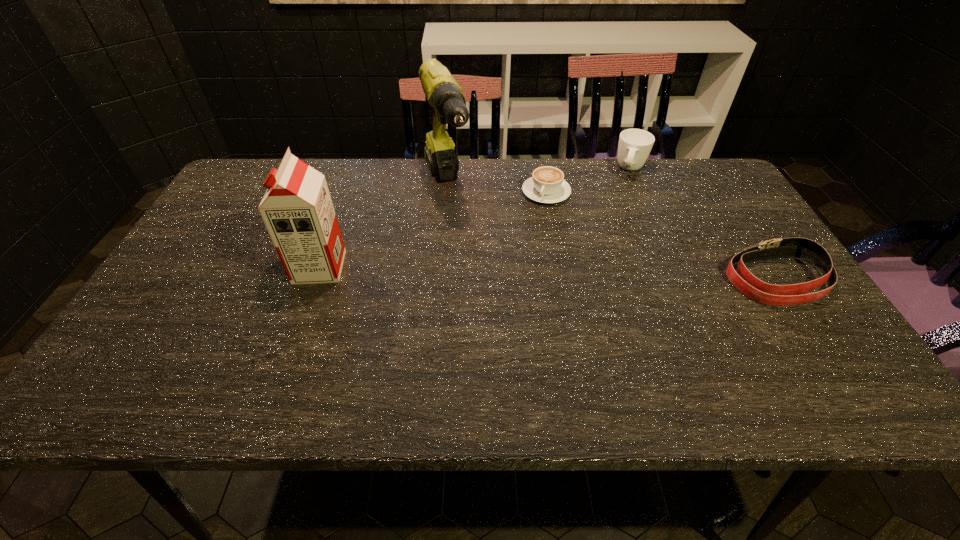
Find the location of a particular element. This screenshot has height=540, width=960. free space that is in between the drill and the soya milk is located at coordinates (383, 227).

The width and height of the screenshot is (960, 540). I want to click on free spot between the dog collar and the leftmost object, so click(548, 273).

This screenshot has width=960, height=540. Identify the location of empty space that is in between the shortest object and the soya milk. (433, 230).

This screenshot has height=540, width=960. Find the location of `unoccupied position between the second object from right to left and the shortest object`. unoccupied position between the second object from right to left and the shortest object is located at coordinates (588, 181).

The width and height of the screenshot is (960, 540). Identify the location of vacant space in between the leftmost object and the dog collar. (548, 273).

Find the location of a particular element. free spot between the soya milk and the fourth object from right to left is located at coordinates (383, 227).

Locate an element on the screen. This screenshot has width=960, height=540. vacant space that is in between the second shortest object and the drill is located at coordinates (612, 233).

Locate which object is the closest to the dog collar. Please provide its 2D coordinates. Your answer should be formatted as a tuple, i.e. [(x, y)], where the tuple contains the x and y coordinates of a point satisfying the conditions above.

[(634, 147)]

Identify the location of object identified as the fourth closest to the soya milk. The image size is (960, 540). (743, 280).

Find the location of a particular element. The image size is (960, 540). vacant area in the image that satisfies the following two spatial constraints: 1. on the front side of the rightmost object; 2. on the left side of the drill is located at coordinates (438, 280).